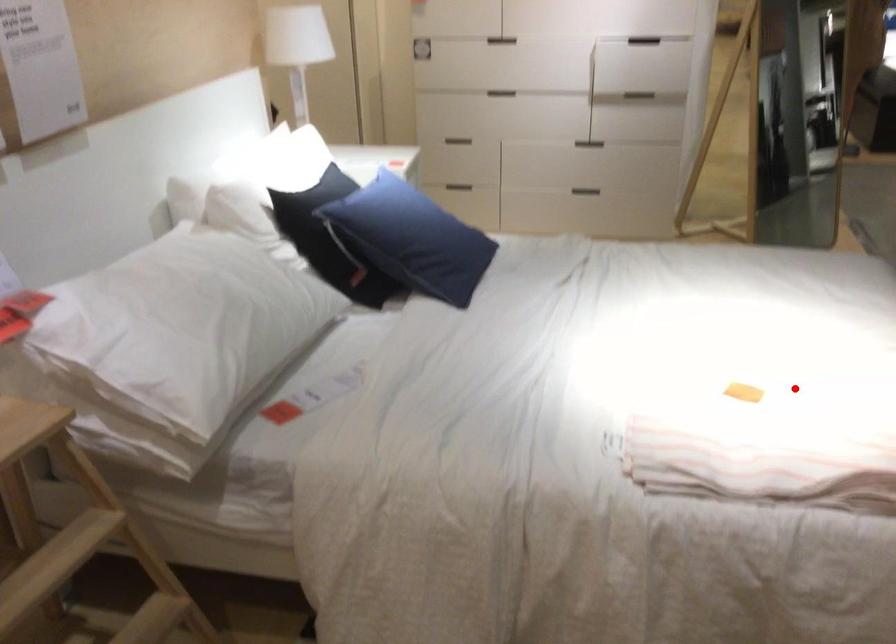
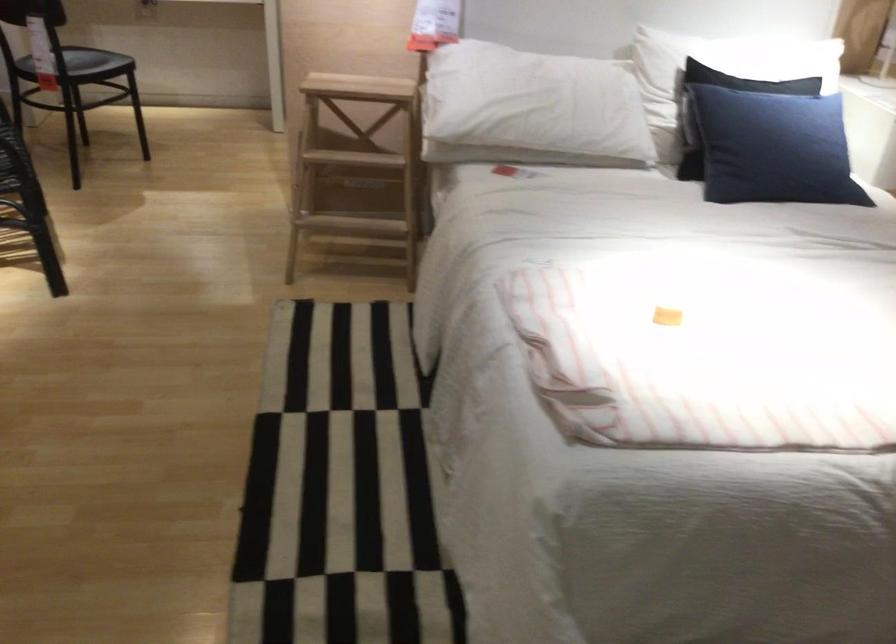
Find the pixel in the second image that matches the highlighted location in the first image.

(702, 355)